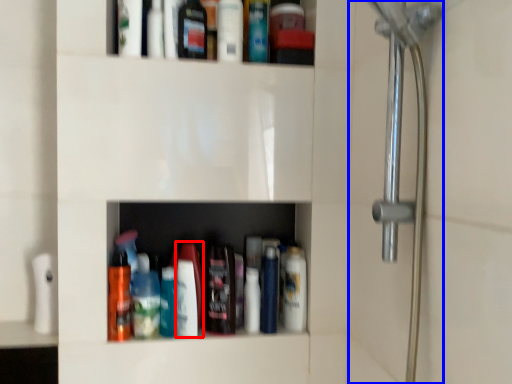
Question: Which point is further to the camera, toiletry (highlighted by a red box) or shower door (highlighted by a blue box)?

Choices:
 (A) toiletry
 (B) shower door

Answer: (A)